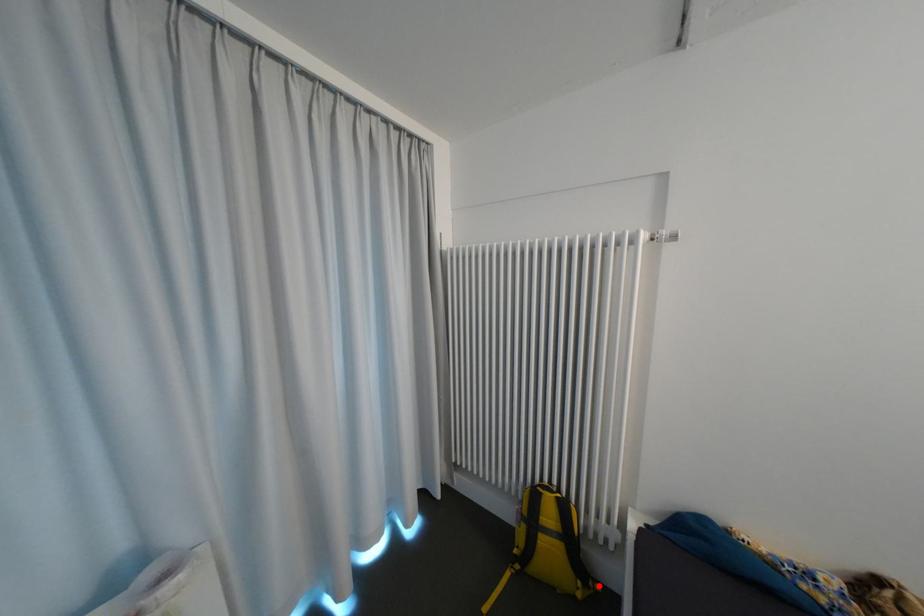
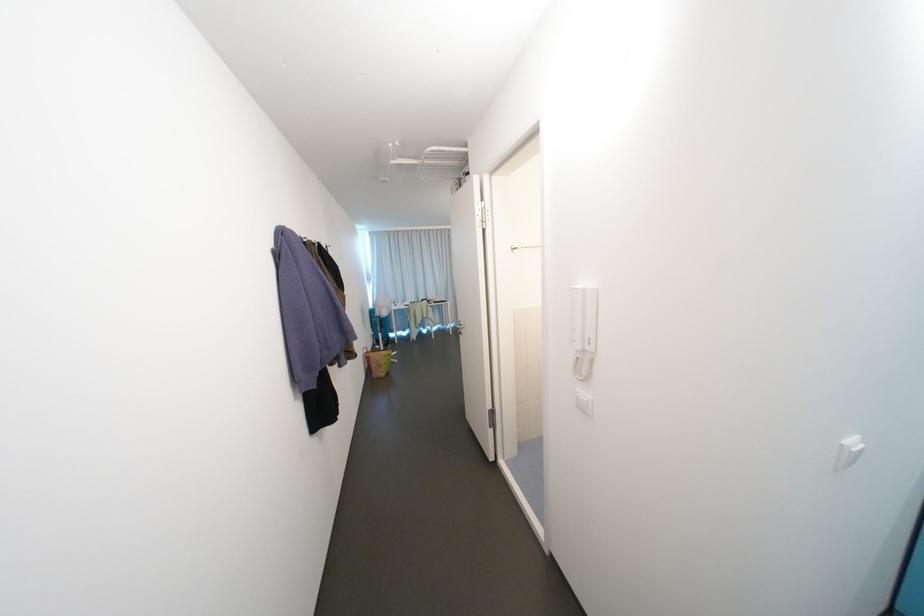
Question: I am providing you with two images of the same scene from different viewpoints. A red point is marked on the first image. At the location where the point appears in image 1, is it still visible in image 2?

Choices:
 (A) Yes
 (B) No

Answer: (B)